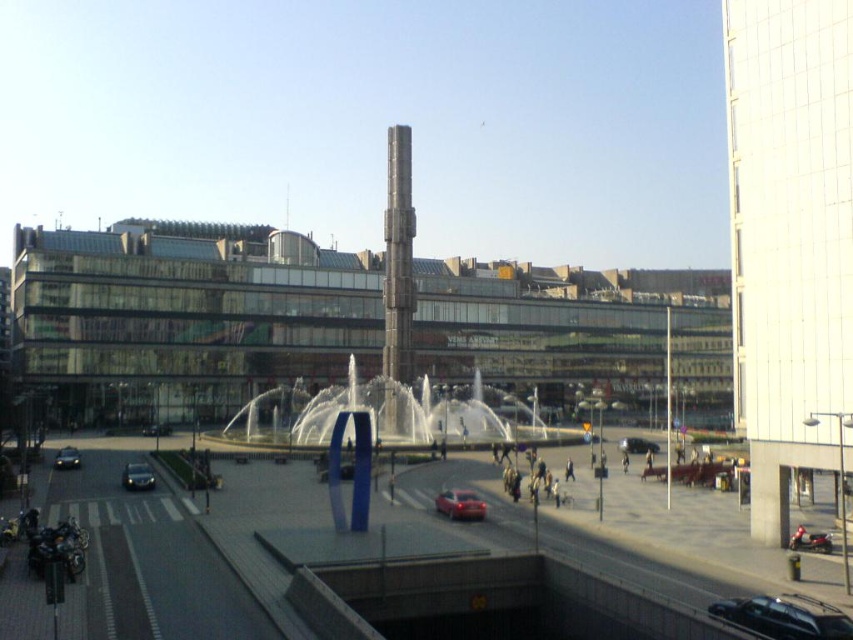
Question: Does shiny chrome motorcycle at lower left appear under shiny chrome motorcycle at lower right?

Choices:
 (A) no
 (B) yes

Answer: (A)

Question: Which point is farther to the camera?

Choices:
 (A) (409, 307)
 (B) (99, 614)
 (C) (135, 483)
 (D) (68, 449)

Answer: (A)

Question: Which point appears closest to the camera in this image?

Choices:
 (A) (798, 605)
 (B) (444, 492)

Answer: (A)

Question: Which point is closer to the camera?

Choices:
 (A) (68, 540)
 (B) (148, 481)

Answer: (A)

Question: Considering the relative positions of sleek metallic tower at center and metallic silver car at lower right in the image provided, where is sleek metallic tower at center located with respect to metallic silver car at lower right?

Choices:
 (A) right
 (B) left

Answer: (B)

Question: Is white glass tower at right behind shiny black sedan at center?

Choices:
 (A) yes
 (B) no

Answer: (B)